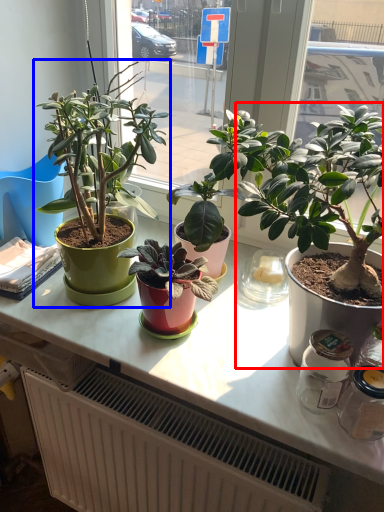
Question: Which object appears farthest to the camera in this image, houseplant (highlighted by a red box) or houseplant (highlighted by a blue box)?

Choices:
 (A) houseplant
 (B) houseplant

Answer: (B)